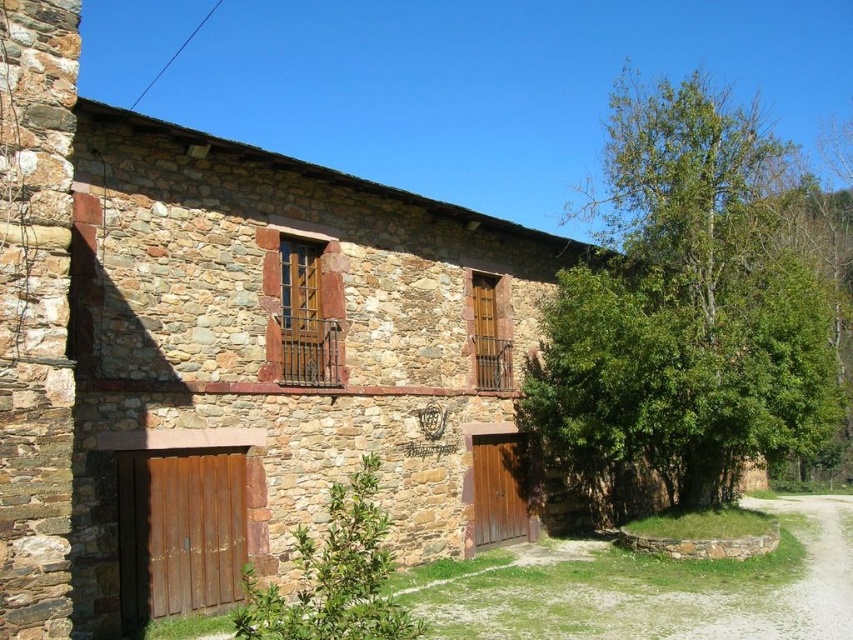
You are standing in front of a rustic stone building. There is a point marked at coordinates (229, 353). What is located at that point?

The point at (229, 353) is where the brown stone barn at center is located.

Where is the brown stone barn at center located in the image?

The brown stone barn at center is located at point (229, 353) in the image.